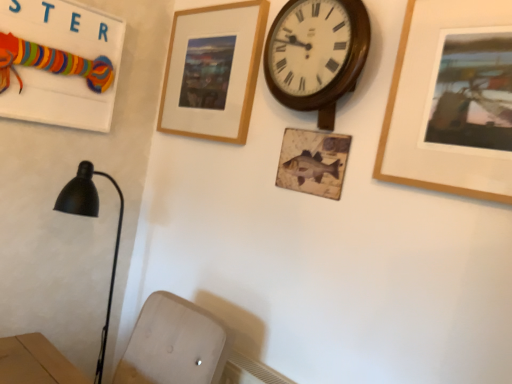
Question: Is wooden picture frame at upper center, the second picture frame positioned from the front, looking in the opposite direction of wooden signboard at upper left?

Choices:
 (A) yes
 (B) no

Answer: (B)

Question: Does wooden picture frame at upper center, the 1th picture frame from the left, have a greater width compared to wooden signboard at upper left?

Choices:
 (A) no
 (B) yes

Answer: (A)

Question: From the image's perspective, is wooden picture frame at upper center, the 1th picture frame from the left, located above wooden signboard at upper left?

Choices:
 (A) no
 (B) yes

Answer: (B)

Question: Can you confirm if wooden picture frame at upper center, the 1th picture frame from the left, is thinner than wooden signboard at upper left?

Choices:
 (A) no
 (B) yes

Answer: (B)

Question: Could you tell me if wooden picture frame at upper center, which appears as the first picture frame when viewed from the back, is facing wooden signboard at upper left?

Choices:
 (A) no
 (B) yes

Answer: (B)

Question: Is point (261, 51) positioned closer to the camera than point (12, 41)?

Choices:
 (A) farther
 (B) closer

Answer: (A)

Question: In the image, is wooden picture frame at upper center, the second picture frame positioned from the front, positioned in front of or behind wooden signboard at upper left?

Choices:
 (A) behind
 (B) front

Answer: (A)

Question: Is wooden picture frame at upper center, the second picture frame positioned from the front, situated inside wooden signboard at upper left or outside?

Choices:
 (A) outside
 (B) inside

Answer: (A)

Question: Would you say wooden picture frame at upper center, which is the 2th picture frame in right-to-left order, is to the left or to the right of wooden signboard at upper left in the picture?

Choices:
 (A) right
 (B) left

Answer: (A)

Question: In terms of size, does wooden wall clock at upper center appear bigger or smaller than wooden picture frame at upper center, the 1th picture frame from the left?

Choices:
 (A) big
 (B) small

Answer: (A)

Question: From the image's perspective, is wooden wall clock at upper center positioned above or below wooden picture frame at upper center, which appears as the first picture frame when viewed from the back?

Choices:
 (A) below
 (B) above

Answer: (A)

Question: Is wooden wall clock at upper center inside or outside of wooden picture frame at upper center, which appears as the first picture frame when viewed from the back?

Choices:
 (A) outside
 (B) inside

Answer: (A)

Question: Based on their positions, is wooden wall clock at upper center located to the left or right of wooden picture frame at upper center, which is the 2th picture frame in right-to-left order?

Choices:
 (A) left
 (B) right

Answer: (B)

Question: Is wooden wall clock at upper center situated inside wooden signboard at upper left or outside?

Choices:
 (A) inside
 (B) outside

Answer: (B)

Question: Does point (297, 31) appear closer or farther from the camera than point (70, 49)?

Choices:
 (A) closer
 (B) farther

Answer: (A)